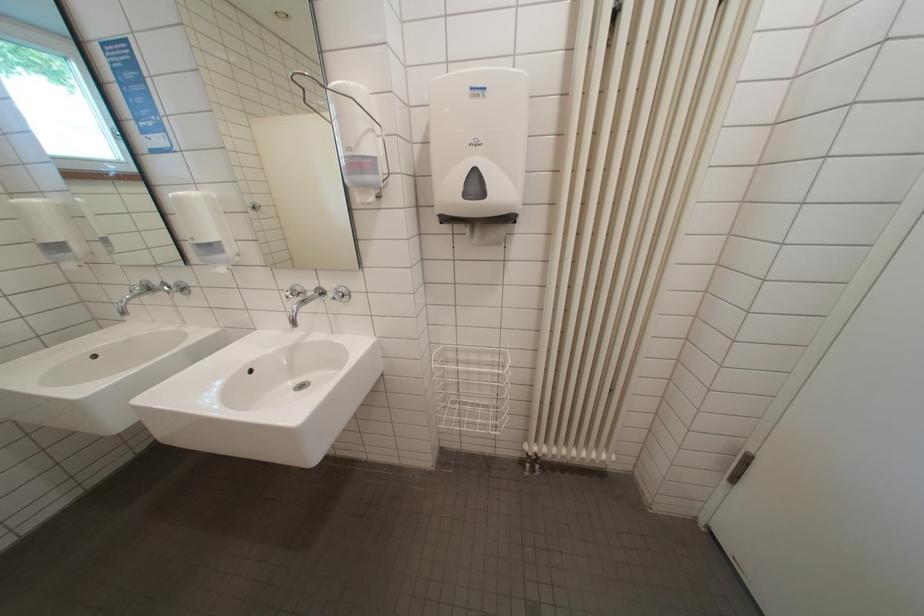
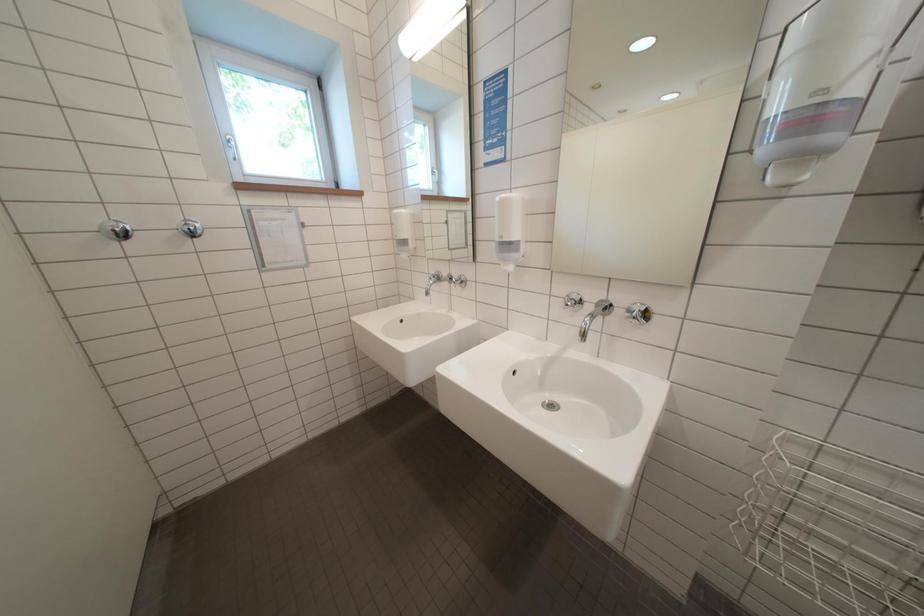
Question: The first image is from the beginning of the video and the second image is from the end. How did the camera likely rotate when shooting the video?

Choices:
 (A) Left
 (B) Right
 (C) Up
 (D) Down

Answer: (A)